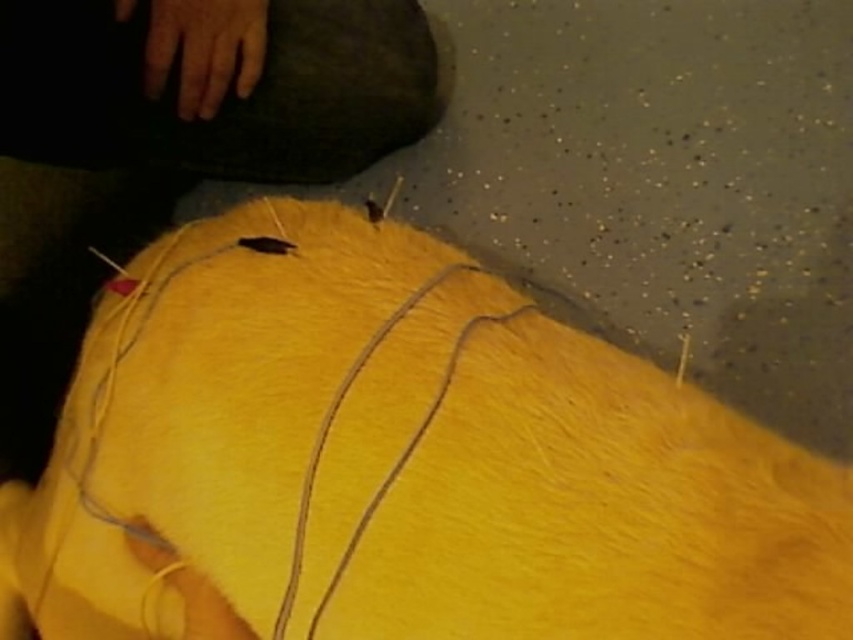
This screenshot has height=640, width=853. In order to click on yellow fabric at center in this screenshot , I will do `click(403, 460)`.

Which is more to the right, yellow fabric at center or yellow fabric string at center?

yellow fabric string at center is more to the right.

Is point (514, 456) closer to viewer compared to point (303, 534)?

That is True.

Find the location of `yellow fabric at center`. yellow fabric at center is located at coordinates (403, 460).